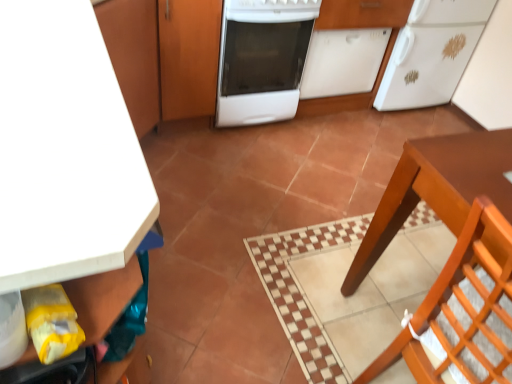
Question: Is the depth of white matte dishwasher at center, acting as the first cabinetry starting from the right, less than that of matte wood cabinet at upper left, the 4th cabinetry positioned from the right?

Choices:
 (A) no
 (B) yes

Answer: (A)

Question: Can you confirm if white matte dishwasher at center, acting as the first cabinetry starting from the right, is bigger than matte wood cabinet at upper left, marked as the first cabinetry in a left-to-right arrangement?

Choices:
 (A) yes
 (B) no

Answer: (B)

Question: Is white matte dishwasher at center, acting as the first cabinetry starting from the right, surrounding matte wood cabinet at upper left, the 4th cabinetry positioned from the right?

Choices:
 (A) yes
 (B) no

Answer: (B)

Question: From the image's perspective, is white matte dishwasher at center, acting as the first cabinetry starting from the right, under matte wood cabinet at upper left, marked as the first cabinetry in a left-to-right arrangement?

Choices:
 (A) yes
 (B) no

Answer: (B)

Question: Could you tell me if white matte dishwasher at center, the 4th cabinetry from the left, is turned towards matte wood cabinet at upper left, marked as the first cabinetry in a left-to-right arrangement?

Choices:
 (A) yes
 (B) no

Answer: (B)

Question: From a real-world perspective, is white matte dishwasher at center, acting as the first cabinetry starting from the right, beneath matte wood cabinet at upper left, marked as the first cabinetry in a left-to-right arrangement?

Choices:
 (A) no
 (B) yes

Answer: (B)

Question: Can you confirm if matte wood cabinet at upper left, the 4th cabinetry positioned from the right, is wider than white matte dishwasher at center, acting as the first cabinetry starting from the right?

Choices:
 (A) no
 (B) yes

Answer: (B)

Question: From a real-world perspective, is matte wood cabinet at upper left, the 4th cabinetry positioned from the right, physically below white matte dishwasher at center, acting as the first cabinetry starting from the right?

Choices:
 (A) yes
 (B) no

Answer: (B)

Question: Can you confirm if matte wood cabinet at upper left, marked as the first cabinetry in a left-to-right arrangement, is smaller than white matte dishwasher at center, acting as the first cabinetry starting from the right?

Choices:
 (A) yes
 (B) no

Answer: (B)

Question: Is matte wood cabinet at upper left, the 4th cabinetry positioned from the right, shorter than white matte dishwasher at center, the 4th cabinetry from the left?

Choices:
 (A) no
 (B) yes

Answer: (A)

Question: Is matte wood cabinet at upper left, the 4th cabinetry positioned from the right, bigger than white matte dishwasher at center, the 4th cabinetry from the left?

Choices:
 (A) yes
 (B) no

Answer: (A)

Question: Is matte wood cabinet at upper left, the 4th cabinetry positioned from the right, thinner than white matte dishwasher at center, the 4th cabinetry from the left?

Choices:
 (A) no
 (B) yes

Answer: (A)

Question: Is matte wood cabinet at upper left, the 4th cabinetry positioned from the right, oriented towards white matte cabinet at upper left, which ranks as the third cabinetry in right-to-left order?

Choices:
 (A) no
 (B) yes

Answer: (A)